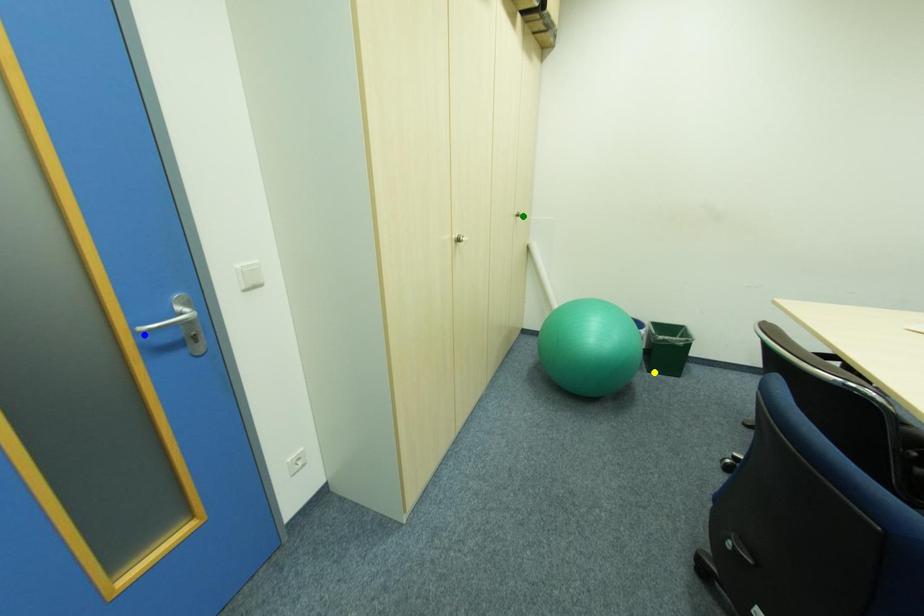
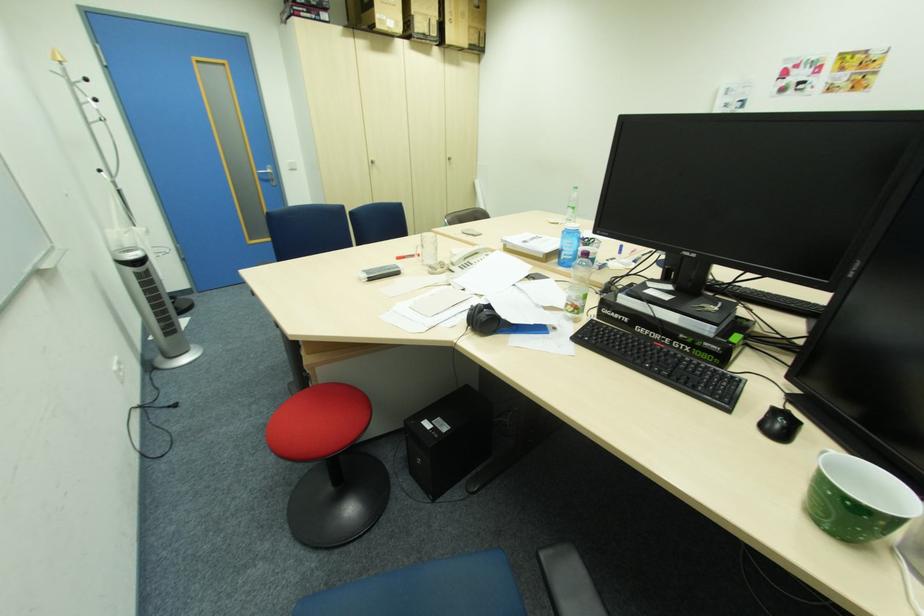
I am providing you with two images of the same scene from different viewpoints. Three points are marked in image1. Which point corresponds to a part or object that is occluded in image2?In image1, three points are marked. Which of them correspond to a part or object that is occluded in image2?Among the three points shown in image1, which one corresponds to a part or object that is no longer visible due to occlusion in image2?

yellow point cannot be seen in image2.